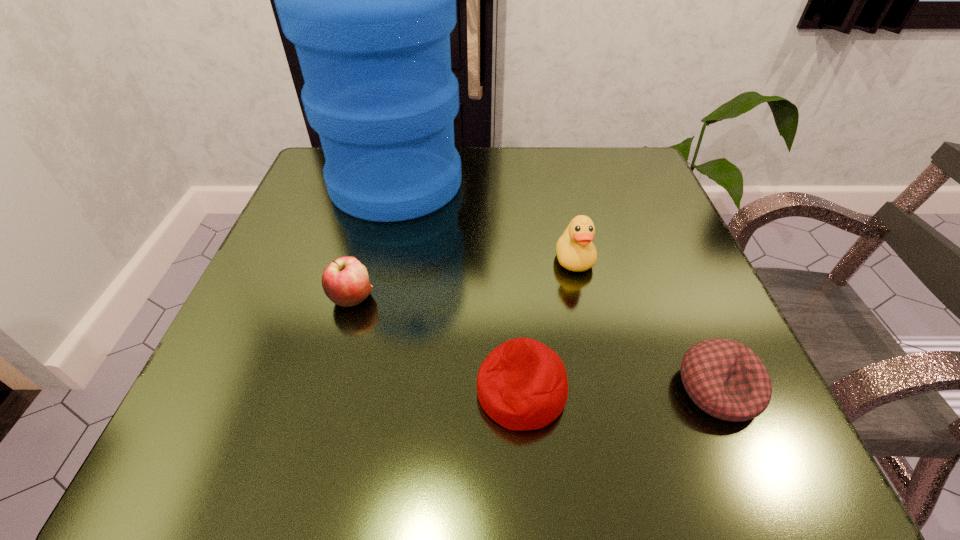
This screenshot has width=960, height=540. Find the location of `the tallest object`. the tallest object is located at coordinates (369, 0).

You are a GUI agent. You are given a task and a screenshot of the screen. Output one action in this format:
    pyautogui.click(x=<x>, y=<y>)
    Task: Click on the farthest object
    
    Given the screenshot: What is the action you would take?
    click(369, 0)

Locate an element on the screen. The width and height of the screenshot is (960, 540). the second farthest object is located at coordinates (575, 251).

At what (x,y) coordinates should I click in order to perform the action: click on duck. Please return your answer as a coordinate pair (x, y). The image size is (960, 540). Looking at the image, I should click on (575, 251).

Find the location of `apple`. apple is located at coordinates (345, 281).

The height and width of the screenshot is (540, 960). I want to click on the third object from right to left, so click(x=522, y=384).

Find the location of `the right beanbag`. the right beanbag is located at coordinates (726, 379).

This screenshot has height=540, width=960. Find the location of `vacant region located 0.230m on the right of the tallest object`. vacant region located 0.230m on the right of the tallest object is located at coordinates (566, 183).

This screenshot has width=960, height=540. In order to click on vacant space located 0.060m at the beak of the second farthest object in this screenshot , I will do `click(584, 303)`.

Where is `vacant space located on the right of the apple`? The image size is (960, 540). vacant space located on the right of the apple is located at coordinates (447, 298).